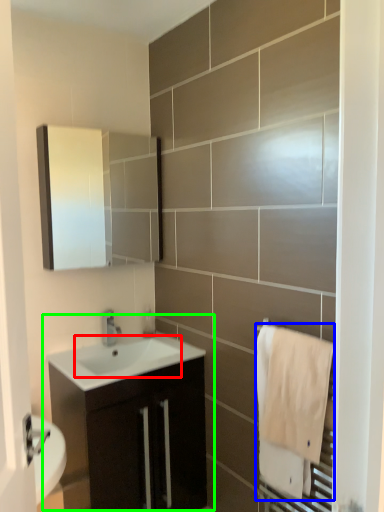
Question: Which is nearer to the sink (highlighted by a red box)? bath towel (highlighted by a blue box) or bathroom cabinet (highlighted by a green box).

Choices:
 (A) bath towel
 (B) bathroom cabinet

Answer: (B)